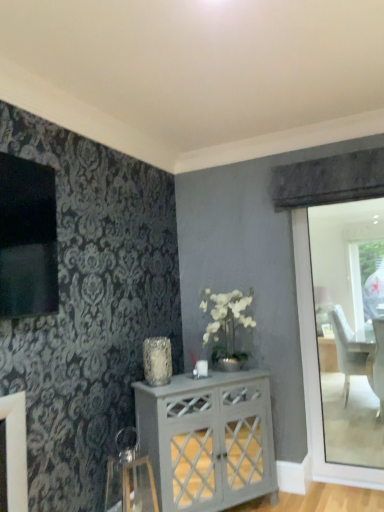
Question: Considering the relative sizes of metallic silver swivel chair at lower left and white painted wood cabinet at center in the image provided, is metallic silver swivel chair at lower left bigger than white painted wood cabinet at center?

Choices:
 (A) no
 (B) yes

Answer: (A)

Question: Is metallic silver swivel chair at lower left taller than white painted wood cabinet at center?

Choices:
 (A) yes
 (B) no

Answer: (B)

Question: Is the surface of metallic silver swivel chair at lower left in direct contact with white painted wood cabinet at center?

Choices:
 (A) no
 (B) yes

Answer: (A)

Question: From the image's perspective, is metallic silver swivel chair at lower left below white painted wood cabinet at center?

Choices:
 (A) no
 (B) yes

Answer: (B)

Question: Would you say metallic silver swivel chair at lower left is outside white painted wood cabinet at center?

Choices:
 (A) no
 (B) yes

Answer: (B)

Question: Does metallic silver swivel chair at lower left have a greater width compared to white painted wood cabinet at center?

Choices:
 (A) no
 (B) yes

Answer: (A)

Question: Does translucent glass vase at center have a greater height compared to metallic silver swivel chair at lower left?

Choices:
 (A) no
 (B) yes

Answer: (A)

Question: Is translucent glass vase at center far away from metallic silver swivel chair at lower left?

Choices:
 (A) no
 (B) yes

Answer: (A)

Question: Can you confirm if translucent glass vase at center is thinner than metallic silver swivel chair at lower left?

Choices:
 (A) yes
 (B) no

Answer: (A)

Question: Is translucent glass vase at center further to camera compared to metallic silver swivel chair at lower left?

Choices:
 (A) no
 (B) yes

Answer: (B)

Question: Are translucent glass vase at center and metallic silver swivel chair at lower left making contact?

Choices:
 (A) no
 (B) yes

Answer: (A)

Question: Is translucent glass vase at center at the left side of metallic silver swivel chair at lower left?

Choices:
 (A) no
 (B) yes

Answer: (A)

Question: Is translucent glass vase at center further to camera compared to white painted wood cabinet at center?

Choices:
 (A) no
 (B) yes

Answer: (B)